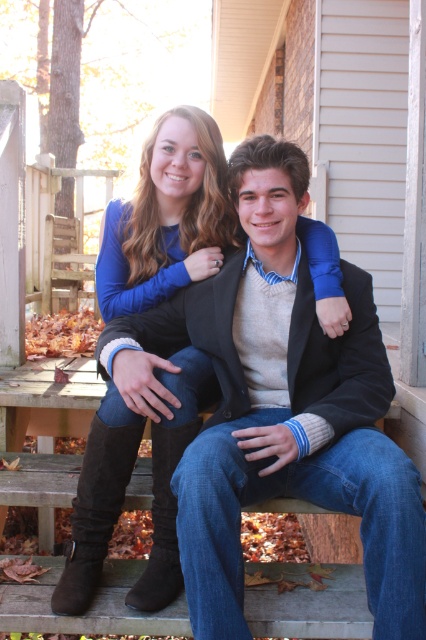
Does point (111, 460) come closer to viewer compared to point (155, 563)?

That is True.

Which is behind, point (80, 518) or point (149, 572)?

Positioned behind is point (80, 518).

Where is `brown suede boot at lower left`? brown suede boot at lower left is located at coordinates (95, 512).

Does suede boots at lower left have a greater height compared to brown suede boot at lower left?

Yes.

Does suede boots at lower left have a lesser width compared to brown suede boot at lower left?

No, suede boots at lower left is not thinner than brown suede boot at lower left.

Is point (100, 529) closer to viewer compared to point (127, 433)?

No.

Where is `suede boots at lower left`? The width and height of the screenshot is (426, 640). suede boots at lower left is located at coordinates (166, 221).

Who is lower down, suede boots at lower left or suede boot at lower left?

suede boot at lower left

Does suede boots at lower left appear over suede boot at lower left?

Yes.

Locate an element on the screen. suede boots at lower left is located at coordinates (166, 221).